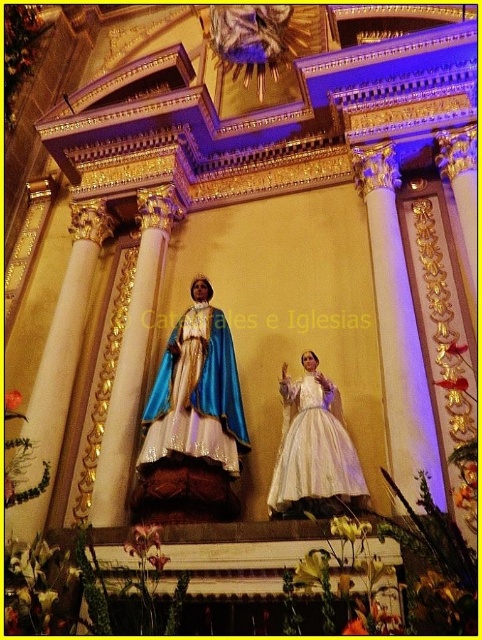
Question: Can you confirm if blue satin dress at center is thinner than white satin dress at center?

Choices:
 (A) no
 (B) yes

Answer: (A)

Question: Considering the relative positions of blue satin dress at center and white satin dress at center in the image provided, where is blue satin dress at center located with respect to white satin dress at center?

Choices:
 (A) right
 (B) left

Answer: (B)

Question: Does blue satin dress at center appear under white satin dress at center?

Choices:
 (A) yes
 (B) no

Answer: (B)

Question: Which point is closer to the camera?

Choices:
 (A) (211, 348)
 (B) (286, 452)

Answer: (B)

Question: Among these objects, which one is nearest to the camera?

Choices:
 (A) white satin dress at center
 (B) blue satin dress at center

Answer: (A)